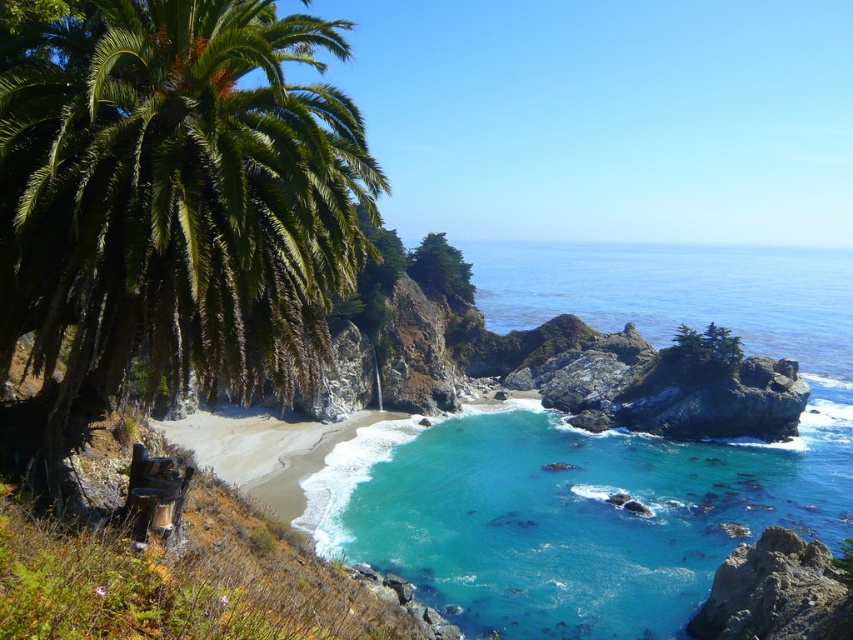
Question: Estimate the real-world distances between objects in this image. Which object is closer to the clear blue water at center?

Choices:
 (A) green leafy palm tree at left
 (B) turquoise glossy water at center

Answer: (B)

Question: Does turquoise glossy water at center lie behind clear blue water at center?

Choices:
 (A) yes
 (B) no

Answer: (B)

Question: Which object appears farthest from the camera in this image?

Choices:
 (A) clear blue water at center
 (B) green leafy palm tree at left

Answer: (A)

Question: Among these points, which one is nearest to the camera?

Choices:
 (A) (544, 566)
 (B) (590, 301)

Answer: (A)

Question: Is turquoise glossy water at center in front of clear blue water at center?

Choices:
 (A) yes
 (B) no

Answer: (A)

Question: Does green leafy palm tree at left have a larger size compared to clear blue water at center?

Choices:
 (A) yes
 (B) no

Answer: (B)